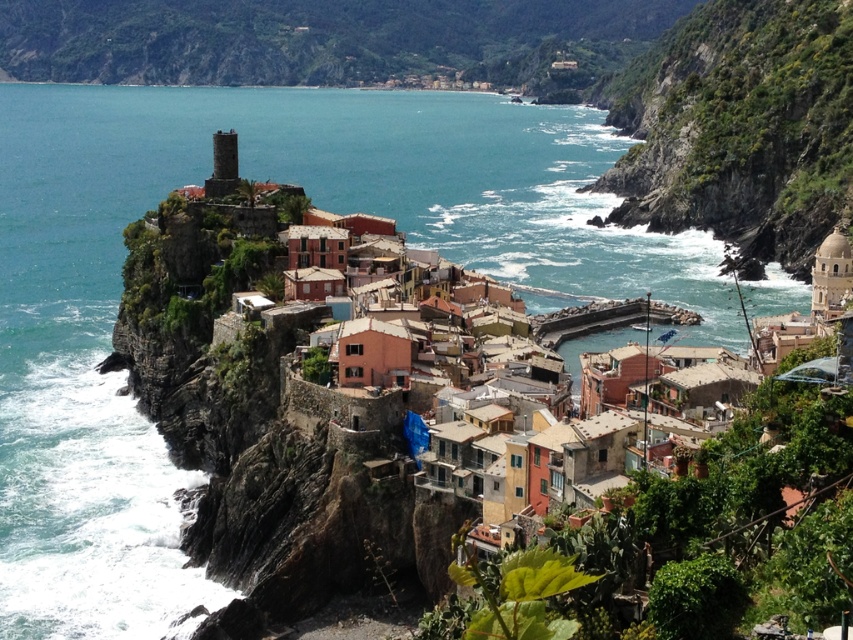
You are a hiker planning to traverse from the green leafy hillside at upper center to the green mossy rock at center right. Given that the distance between them is 241.13 meters, can you estimate how long it would take to walk this path if your average walking speed is 3 meters per second?

The distance between the green leafy hillside at upper center and the green mossy rock at center right is 241.13 meters. At an average walking speed of 3 meters per second, it would take approximately 80.38 seconds, which is roughly 1 minute and 20 seconds, to traverse the path.

You are standing in the coastal village and want to take a photo that includes both the green leafy hillside at upper center and the green mossy rock at center right. Which object should you position closer to the front of your camera frame to ensure both are in focus?

To ensure both the green leafy hillside at upper center and the green mossy rock at center right are in focus, position the green leafy hillside at upper center closer to the front of your camera frame since it is closer to you than the green mossy rock at center right.